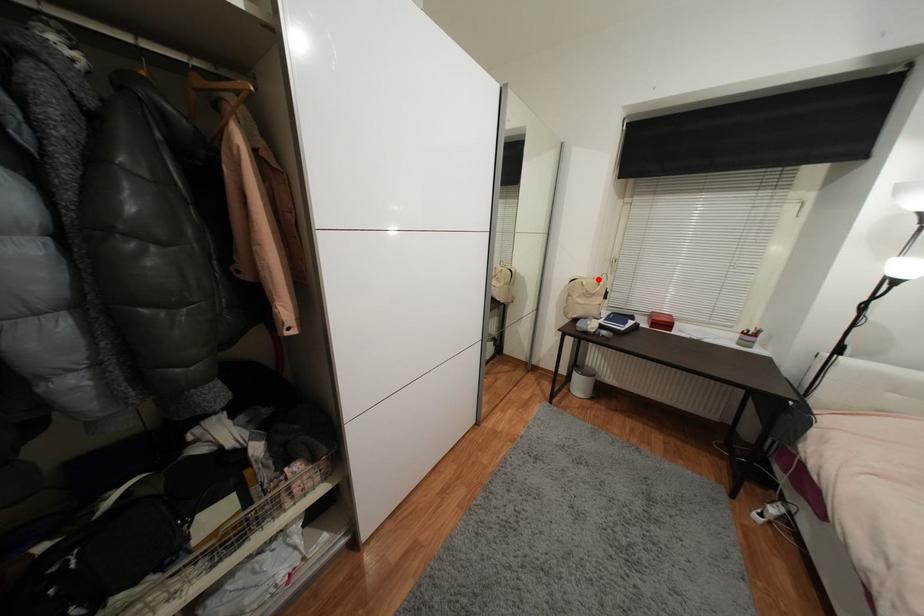
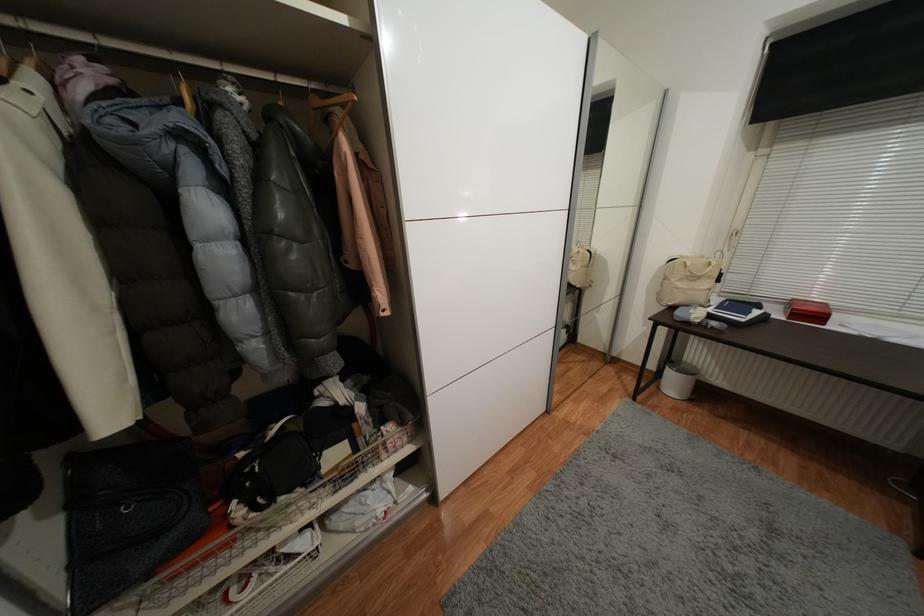
Where in the second image is the point corresponding to the highlighted location from the first image?

(707, 257)